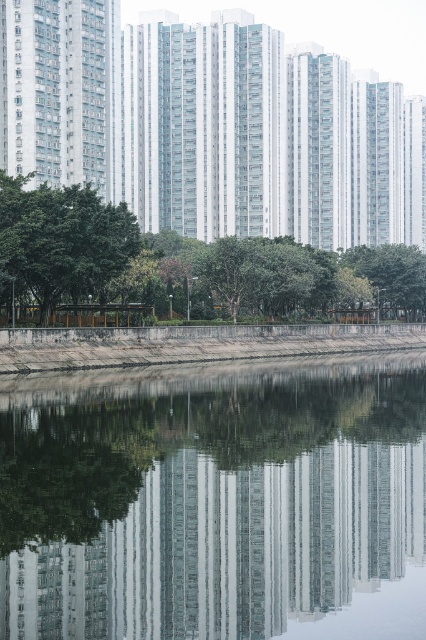
Question: Which point is closer to the camera?

Choices:
 (A) green leafy tree at center
 (B) transparent glass water at center
 (C) dull concrete wall at lower center
 (D) green leafy tree at lower left

Answer: (B)

Question: Which point is farther to the camera?

Choices:
 (A) transparent glass water at center
 (B) green leafy tree at lower left
 (C) green leafy tree at center
 (D) dull concrete wall at lower center

Answer: (C)

Question: Observing the image, what is the correct spatial positioning of transparent glass water at center in reference to green leafy tree at center?

Choices:
 (A) right
 (B) left

Answer: (A)

Question: Among these points, which one is nearest to the camera?

Choices:
 (A) (97, 259)
 (B) (345, 332)

Answer: (A)

Question: Considering the relative positions of transparent glass water at center and green leafy tree at center in the image provided, where is transparent glass water at center located with respect to green leafy tree at center?

Choices:
 (A) right
 (B) left

Answer: (A)

Question: Is green leafy tree at center further to camera compared to dull concrete wall at lower center?

Choices:
 (A) no
 (B) yes

Answer: (B)